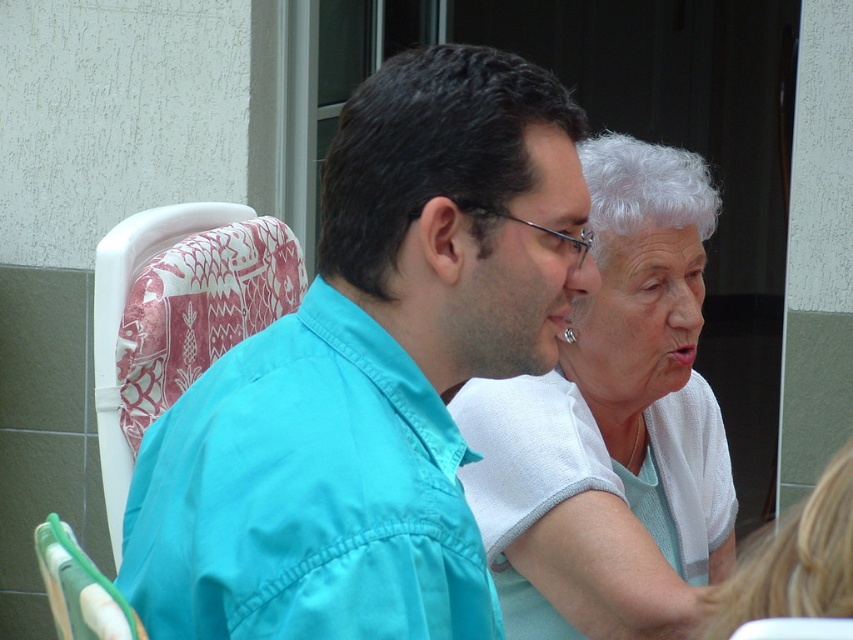
Question: Is matte teal shirt at center thinner than white fabric at upper right?

Choices:
 (A) no
 (B) yes

Answer: (B)

Question: Is white textured shirt at center positioned before matte teal shirt at center?

Choices:
 (A) yes
 (B) no

Answer: (B)

Question: Among these points, which one is farthest from the camera?

Choices:
 (A) (338, 493)
 (B) (494, 461)

Answer: (B)

Question: Which point is farther from the camera taking this photo?

Choices:
 (A) (541, 349)
 (B) (680, 330)
 (C) (505, 289)

Answer: (B)

Question: Does white textured shirt at center appear under matte teal shirt at center?

Choices:
 (A) yes
 (B) no

Answer: (A)

Question: Which object is the farthest from the white fabric at upper right?

Choices:
 (A) teal fabric shirt at center
 (B) white textured shirt at center

Answer: (A)